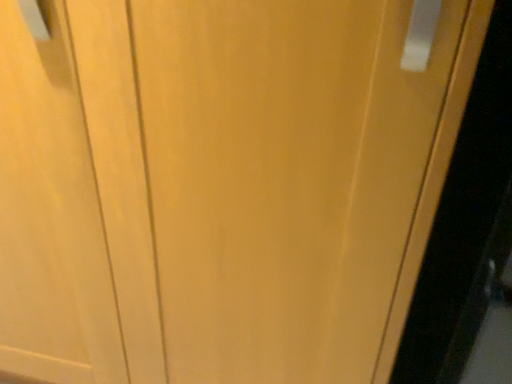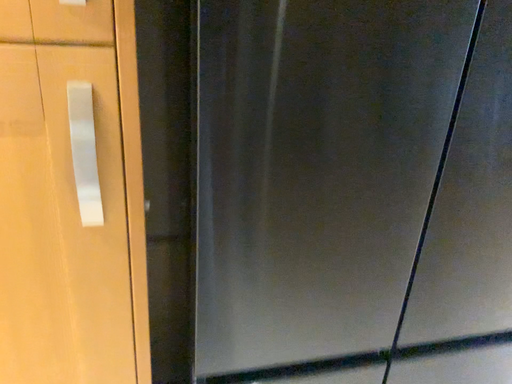
Question: Which way did the camera rotate in the video?

Choices:
 (A) rotated left
 (B) rotated right

Answer: (B)